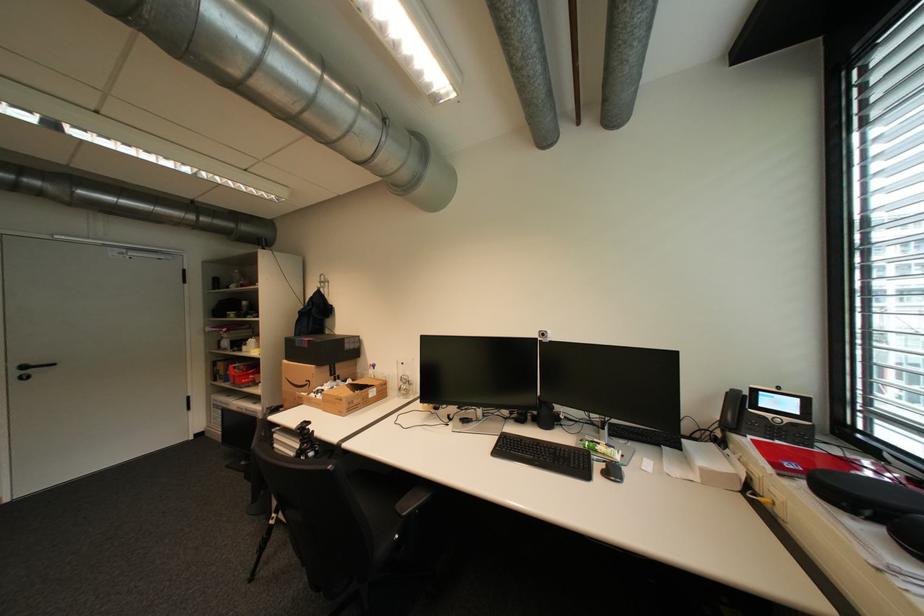
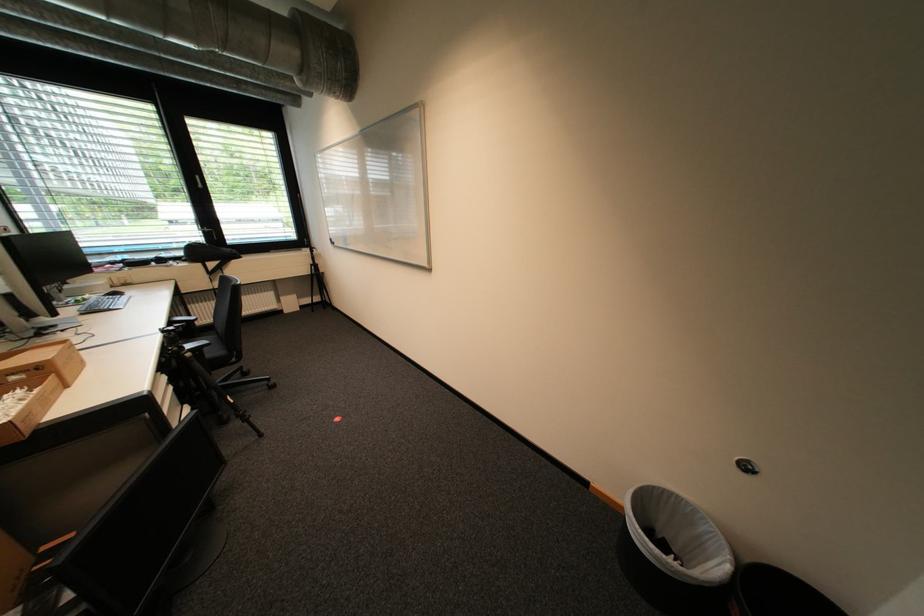
Question: I am providing you with two images of the same scene from different viewpoints. Please identify which objects are invisible in image2.

Choices:
 (A) white paper
 (B) black phone handset
 (C) white-lined trash can
 (D) black chair armrest

Answer: (B)